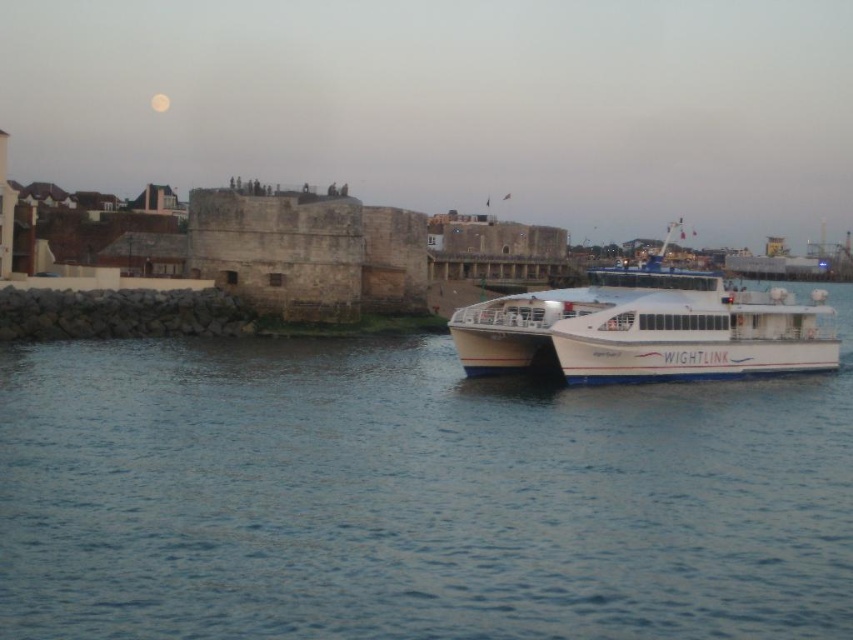
Question: Where is blue water at center located in relation to white matte ferry at right in the image?

Choices:
 (A) below
 (B) above

Answer: (A)

Question: Does blue water at center have a larger size compared to white matte ferry at right?

Choices:
 (A) no
 (B) yes

Answer: (A)

Question: Among these objects, which one is farthest from the camera?

Choices:
 (A) white matte ferry at right
 (B) blue water at center

Answer: (A)

Question: Which point is closer to the camera taking this photo?

Choices:
 (A) (717, 376)
 (B) (334, 502)

Answer: (B)

Question: Does blue water at center have a smaller size compared to white matte ferry at right?

Choices:
 (A) yes
 (B) no

Answer: (A)

Question: Which point is closer to the camera?

Choices:
 (A) white matte ferry at right
 (B) blue water at center

Answer: (B)